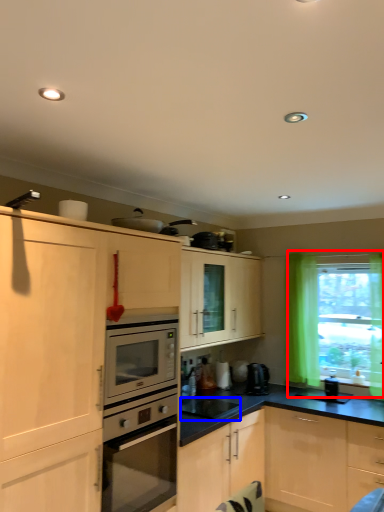
Question: Which of the following is the closest to the observer, window (highlighted by a red box) or appliance (highlighted by a blue box)?

Choices:
 (A) window
 (B) appliance

Answer: (B)